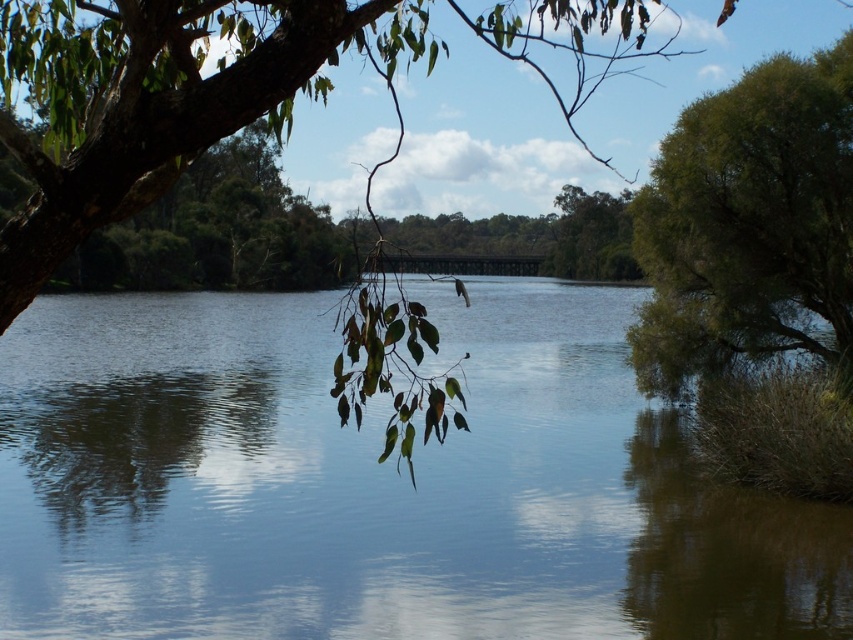
You are standing at the riverside and see two points in the image. The first point is at coordinate point (33, 56) and the second is at point (807, 116). Which point is closer to your viewpoint?

Point (33, 56) is closer to the camera than point (807, 116), so the first point is closer to your viewpoint.

You are a photographer standing at the riverside and want to capture a shot of both the clear water at center and the green leafy bush at right. Which object will appear closer to the camera in the photo?

The clear water at center appears closer to the camera because it is positioned in front of the green leafy bush at right.

You are an artist sketching this riverside scene. You want to emphasize the contrast between the green leafy branch at upper left and the green leafy bush at right. Which one should you draw larger to maintain accuracy?

The green leafy branch at upper left should be drawn larger because it has a larger size compared to the green leafy bush at right.